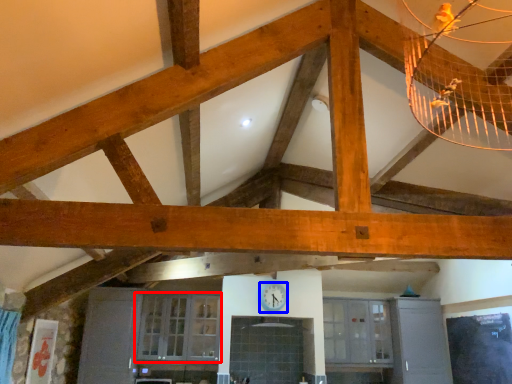
Question: Among these objects, which one is nearest to the camera, window (highlighted by a red box) or clock (highlighted by a blue box)?

Choices:
 (A) window
 (B) clock

Answer: (A)